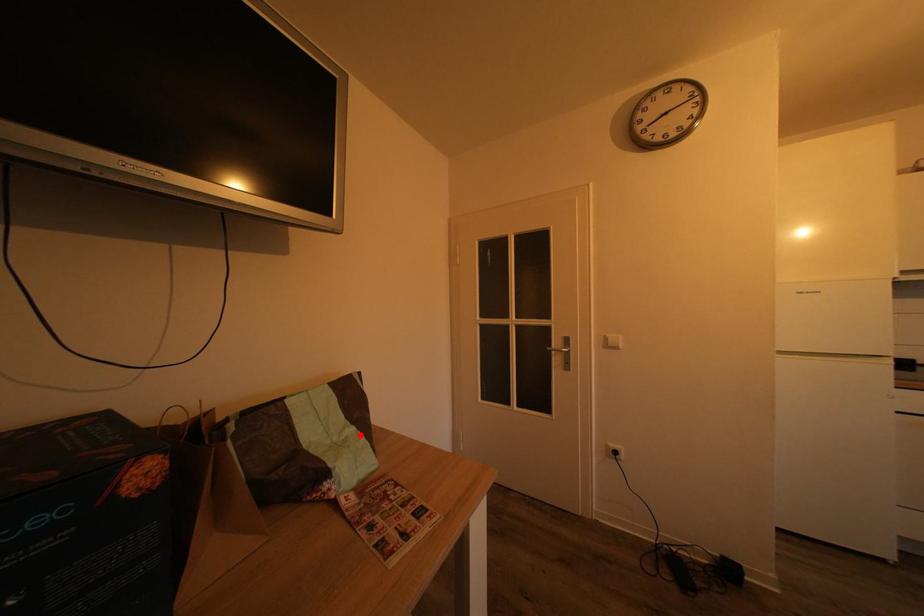
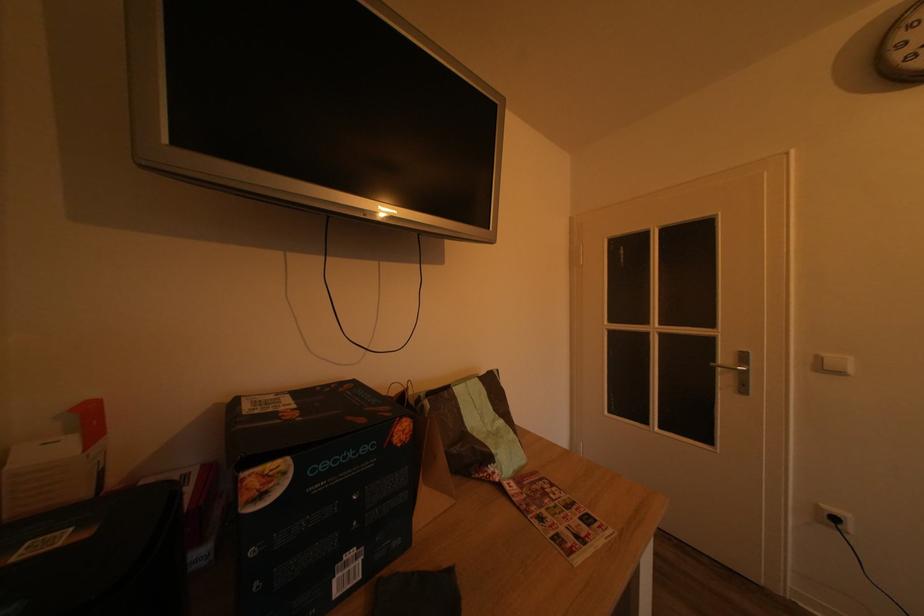
Locate, in the second image, the point that corresponds to the highlighted location in the first image.

(508, 428)